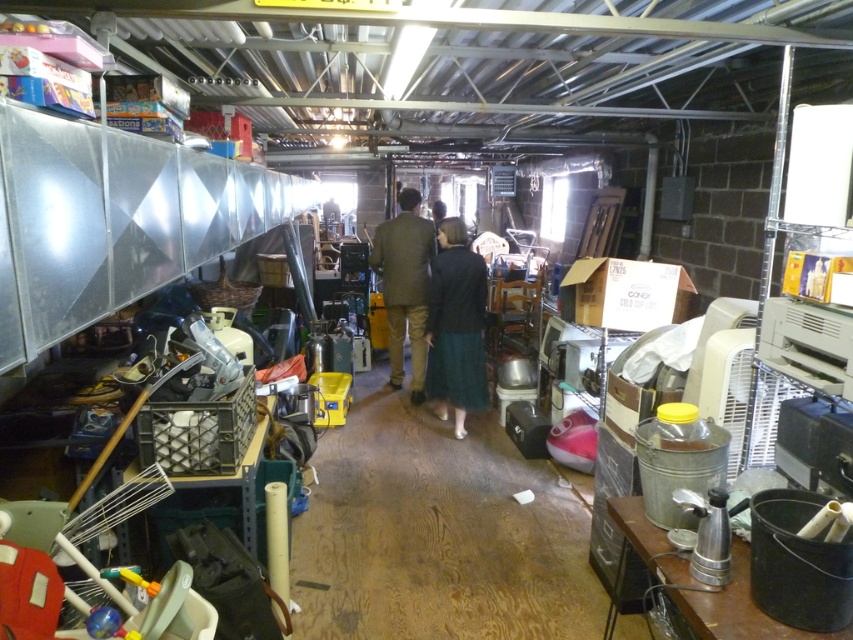
You are organizing items in the storage area and need to retrieve the brown wool coat at center. However, the dark green skirt at center is blocking your path. Can you move the skirt to access the coat?

The dark green skirt at center is in front of the brown wool coat at center, so moving the skirt would allow access to the coat.

You are organizing a clothing donation drive and need to pack items into boxes. You have a box that can only fit items narrower than 18 inches. You find a dark green skirt at center and a brown wool coat at center. Which item can fit into the box?

The dark green skirt at center can fit into the box because its width is less than the brown wool coat at center, and if the coat is wider than 18 inches, the skirt, being narrower, would likely be under the 18 inch limit.

You are organizing items in a storage area and need to place a new item near the dark green skirt at center. Based on the coordinates provided, where exactly should you place the new item?

The dark green skirt at center is located at point (456,326), so you should place the new item near those coordinates to ensure it is close to the dark green skirt at center.